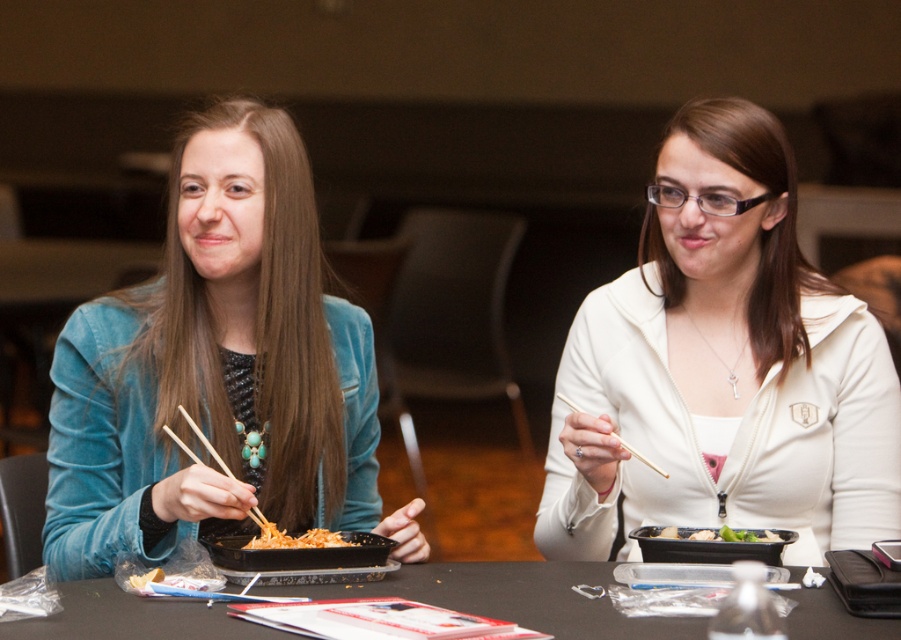
Question: Is velvet teal jacket at center positioned behind black matte tray at center?

Choices:
 (A) yes
 (B) no

Answer: (A)

Question: Which object appears closest to the camera in this image?

Choices:
 (A) wooden chopsticks at left
 (B) black plastic tray at center

Answer: (A)

Question: Which object is the closest to the black plastic tray at center?

Choices:
 (A) black plastic table at center
 (B) shiny orange noodles at center
 (C) wooden chopsticks at upper center
 (D) white matte jacket at center

Answer: (C)

Question: Does black plastic tray at center appear under shiny orange noodles at center?

Choices:
 (A) no
 (B) yes

Answer: (B)

Question: Which point is farther from the camera taking this photo?

Choices:
 (A) (411, 595)
 (B) (763, 416)

Answer: (B)

Question: Does shiny orange noodles at center have a larger size compared to green leafy vegetable at center?

Choices:
 (A) yes
 (B) no

Answer: (B)